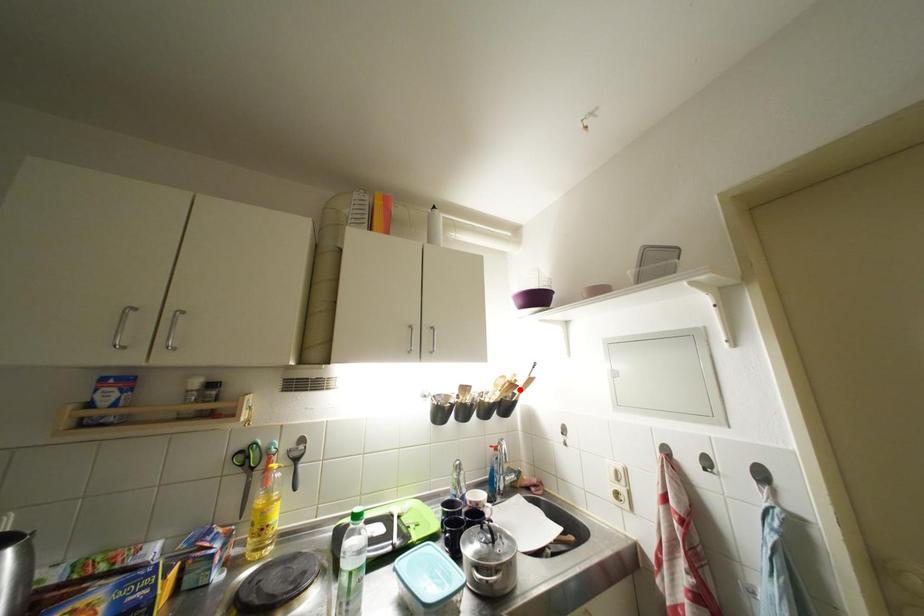
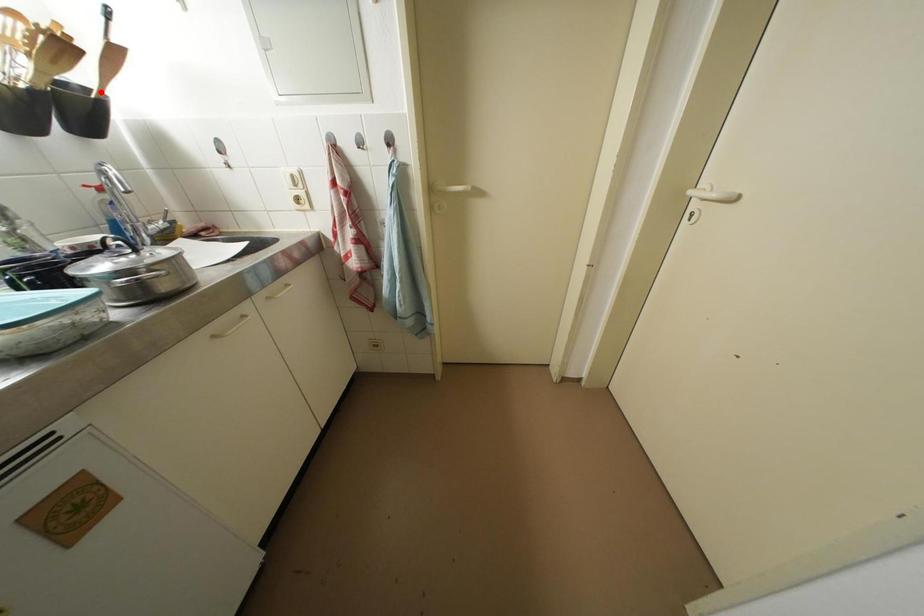
I am providing you with two images of the same scene from different viewpoints. A red point is marked on the first image and another point is marked on the second image. Is the red point in image1 aligned with the point shown in image2?

No